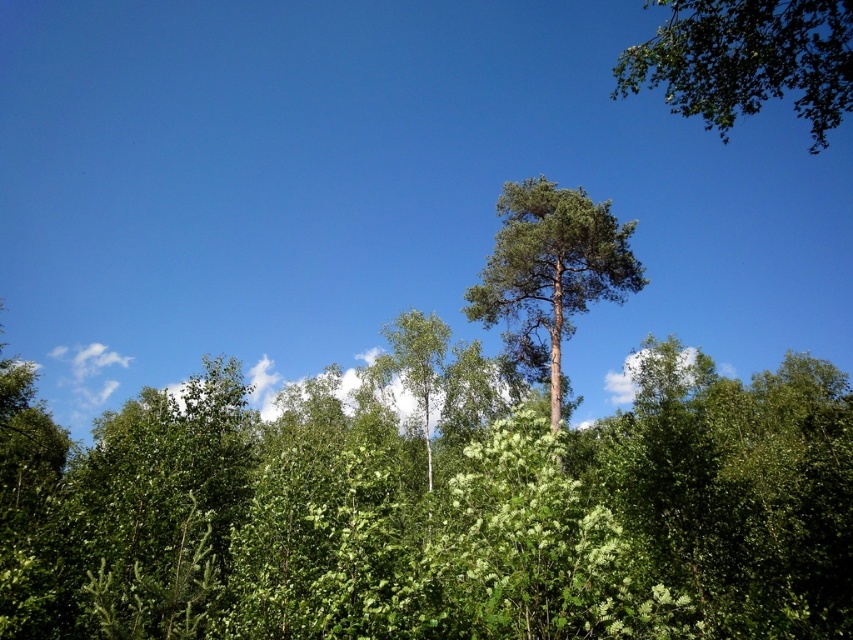
Question: Which point appears closest to the camera in this image?

Choices:
 (A) (525, 292)
 (B) (787, 44)

Answer: (B)

Question: Can you confirm if green leafy forest at center is positioned to the right of green needle-like at center?

Choices:
 (A) no
 (B) yes

Answer: (A)

Question: Is green leafy forest at center smaller than green needle-like at center?

Choices:
 (A) yes
 (B) no

Answer: (B)

Question: Which point is closer to the camera?

Choices:
 (A) (718, 76)
 (B) (432, 548)

Answer: (B)

Question: Estimate the real-world distances between objects in this image. Which object is closer to the green leafy tree at upper right?

Choices:
 (A) green leafy forest at center
 (B) green needle-like at center

Answer: (B)

Question: Considering the relative positions of green leafy tree at upper right and green needle-like at center in the image provided, where is green leafy tree at upper right located with respect to green needle-like at center?

Choices:
 (A) left
 (B) right

Answer: (B)